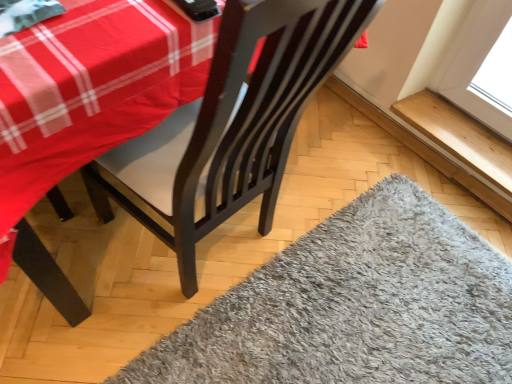
Question: Is wooden at upper right oriented away from gray shaggy rug at lower right?

Choices:
 (A) no
 (B) yes

Answer: (A)

Question: Can you confirm if wooden at upper right is thinner than gray shaggy rug at lower right?

Choices:
 (A) yes
 (B) no

Answer: (A)

Question: Can you confirm if wooden at upper right is shorter than gray shaggy rug at lower right?

Choices:
 (A) yes
 (B) no

Answer: (A)

Question: From the image's perspective, is wooden at upper right located beneath gray shaggy rug at lower right?

Choices:
 (A) yes
 (B) no

Answer: (B)

Question: Is wooden at upper right beside gray shaggy rug at lower right?

Choices:
 (A) yes
 (B) no

Answer: (B)

Question: Is wooden at upper right positioned before gray shaggy rug at lower right?

Choices:
 (A) yes
 (B) no

Answer: (B)

Question: From a real-world perspective, is gray shaggy rug at lower right below wooden at upper right?

Choices:
 (A) no
 (B) yes

Answer: (B)

Question: Would you say gray shaggy rug at lower right is outside wooden at upper right?

Choices:
 (A) yes
 (B) no

Answer: (A)

Question: Is gray shaggy rug at lower right facing towards wooden at upper right?

Choices:
 (A) yes
 (B) no

Answer: (B)

Question: Can you confirm if gray shaggy rug at lower right is bigger than wooden at upper right?

Choices:
 (A) no
 (B) yes

Answer: (B)

Question: Are gray shaggy rug at lower right and wooden at upper right far apart?

Choices:
 (A) yes
 (B) no

Answer: (B)

Question: Is gray shaggy rug at lower right shorter than wooden at upper right?

Choices:
 (A) no
 (B) yes

Answer: (A)

Question: From a real-world perspective, relative to gray shaggy rug at lower right, is wooden at upper right vertically above or below?

Choices:
 (A) above
 (B) below

Answer: (A)